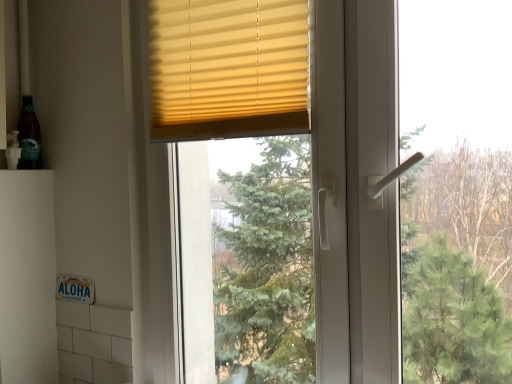
Question: Can you confirm if yellow matte blinds at upper center is positioned to the right of translucent glass bottle at left?

Choices:
 (A) no
 (B) yes

Answer: (B)

Question: Is yellow matte blinds at upper center to the left of translucent glass bottle at left from the viewer's perspective?

Choices:
 (A) yes
 (B) no

Answer: (B)

Question: Would you say translucent glass bottle at left is part of yellow matte blinds at upper center's contents?

Choices:
 (A) no
 (B) yes

Answer: (A)

Question: Is yellow matte blinds at upper center shorter than translucent glass bottle at left?

Choices:
 (A) no
 (B) yes

Answer: (A)

Question: Is yellow matte blinds at upper center taller than translucent glass bottle at left?

Choices:
 (A) no
 (B) yes

Answer: (B)

Question: Is yellow matte blinds at upper center far from translucent glass bottle at left?

Choices:
 (A) no
 (B) yes

Answer: (A)

Question: Considering the relative positions of translucent glass bottle at left and yellow matte blinds at upper center in the image provided, is translucent glass bottle at left in front of yellow matte blinds at upper center?

Choices:
 (A) no
 (B) yes

Answer: (A)

Question: Are translucent glass bottle at left and yellow matte blinds at upper center beside each other?

Choices:
 (A) no
 (B) yes

Answer: (A)

Question: From a real-world perspective, is translucent glass bottle at left located beneath yellow matte blinds at upper center?

Choices:
 (A) no
 (B) yes

Answer: (B)

Question: Is translucent glass bottle at left further to camera compared to yellow matte blinds at upper center?

Choices:
 (A) yes
 (B) no

Answer: (A)

Question: From the image's perspective, is translucent glass bottle at left on yellow matte blinds at upper center?

Choices:
 (A) yes
 (B) no

Answer: (B)

Question: Does translucent glass bottle at left have a larger size compared to yellow matte blinds at upper center?

Choices:
 (A) no
 (B) yes

Answer: (A)

Question: Is point (293, 19) positioned closer to the camera than point (20, 117)?

Choices:
 (A) farther
 (B) closer

Answer: (B)